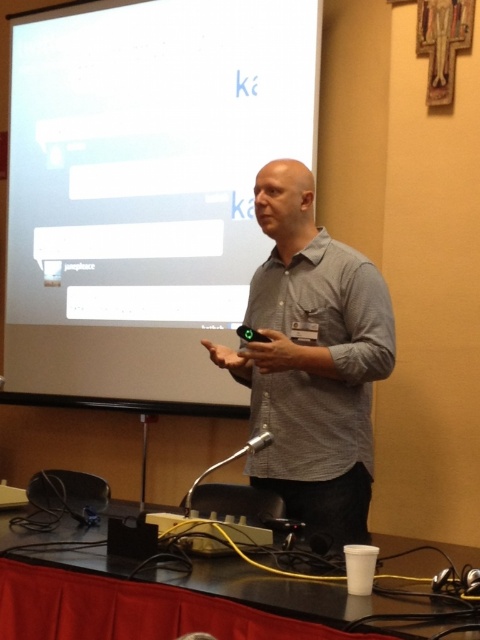
You are attending a presentation and notice the speaker wearing a gray checkered shirt at center and holding a metallic silver microphone at lower center. Which object is wider?

The gray checkered shirt at center is wider than the metallic silver microphone at lower center.

Based on the scene description, can you determine the spatial relationship between the gray checkered shirt at center and the metallic silver microphone at lower center?

The gray checkered shirt at center is above the metallic silver microphone at lower center.